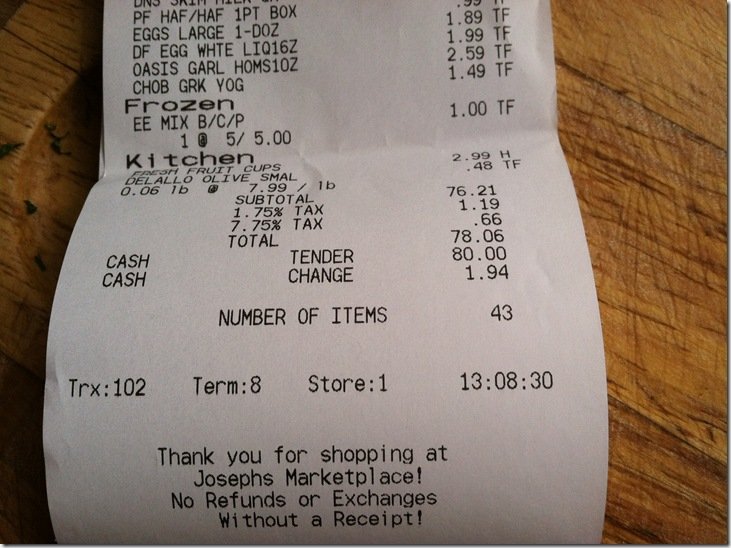
Where is `wooden table`? wooden table is located at coordinates (645, 182).